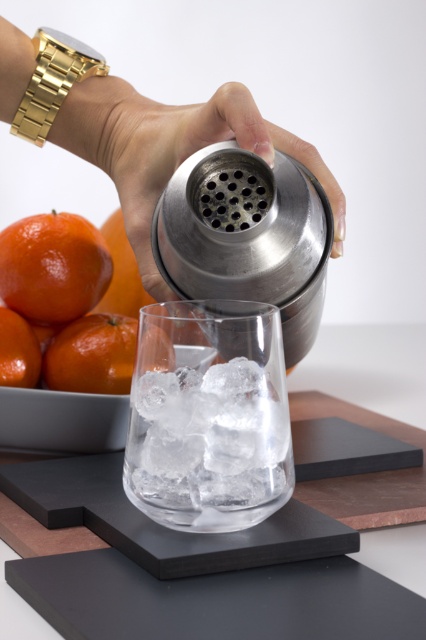
Question: Which object appears farthest from the camera in this image?

Choices:
 (A) orangesmoothorange at left
 (B) glossy orange at center left
 (C) orangesmoothorange at lower left

Answer: (A)

Question: Which of the following is the closest to the observer?

Choices:
 (A) (134, 273)
 (B) (103, 324)

Answer: (B)

Question: Is transparent glass at center positioned at the back of glossy orange at center left?

Choices:
 (A) no
 (B) yes

Answer: (A)

Question: Where is glossy orange at center left located in relation to orangesmoothorange at lower left in the image?

Choices:
 (A) above
 (B) below

Answer: (A)

Question: Among these points, which one is farthest from the camera?

Choices:
 (A) click(x=95, y=392)
 (B) click(x=293, y=337)
 (C) click(x=55, y=268)

Answer: (C)

Question: Can you confirm if transparent glass at center is wider than orangesmoothorange at lower left?

Choices:
 (A) no
 (B) yes

Answer: (B)